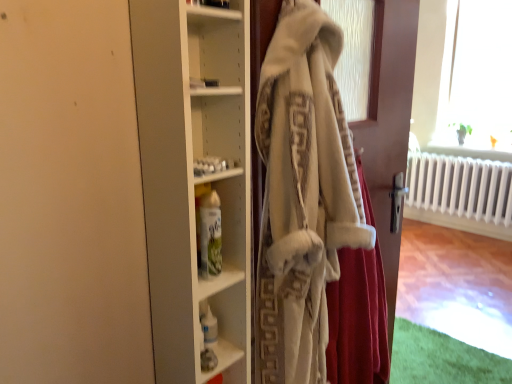
Question: In terms of width, does white fluffy bathrobe at center look wider or thinner when compared to white glossy spray can at center, positioned as the second shelf in back-to-front order?

Choices:
 (A) wide
 (B) thin

Answer: (A)

Question: From the image's perspective, relative to white glossy spray can at center, which ranks as the first shelf in front-to-back order, is white fluffy bathrobe at center above or below?

Choices:
 (A) below
 (B) above

Answer: (A)

Question: Based on their relative distances, which object is farther from the white glossy spray can at center, marked as the 1th shelf in a top-to-bottom arrangement?

Choices:
 (A) white plastic bottle at lower center, which is the 1th shelf in back-to-front order
 (B) white matte cupboard at center
 (C) fuzzy white shawl at center
 (D) white fluffy bathrobe at center

Answer: (D)

Question: Considering the real-world distances, which object is farthest from the white plastic bottle at lower center, which is the 1th shelf from bottom to top?

Choices:
 (A) white fluffy bathrobe at center
 (B) white glossy spray can at center, acting as the 2th shelf starting from the bottom
 (C) white matte cupboard at center
 (D) fuzzy white shawl at center

Answer: (A)